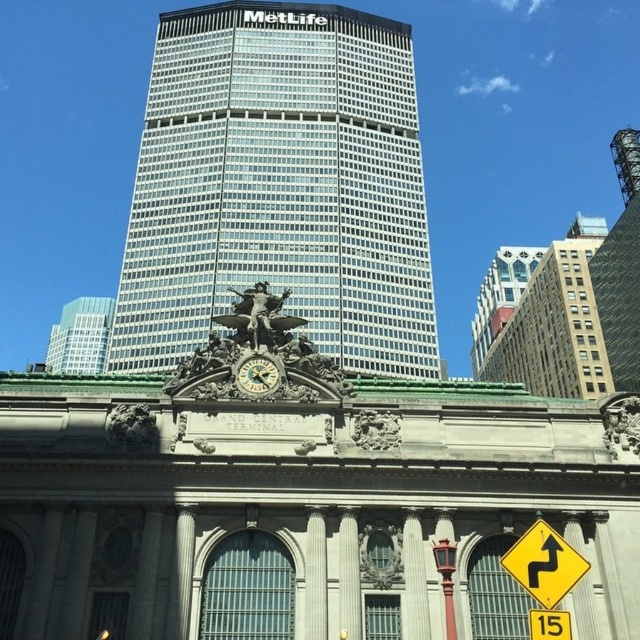
Question: Can you confirm if glassy steel skyscraper at center is positioned below yellow plastic traffic sign at lower right?

Choices:
 (A) no
 (B) yes

Answer: (A)

Question: Can you confirm if glassy steel skyscraper at center is positioned above gold metallic clock at center?

Choices:
 (A) yes
 (B) no

Answer: (A)

Question: Which object is the farthest from the red wood pole at center?

Choices:
 (A) yellow plastic traffic sign at upper right
 (B) brick building at upper right

Answer: (B)

Question: Estimate the real-world distances between objects in this image. Which object is closer to the gold metallic clock at center?

Choices:
 (A) brick building at upper right
 (B) yellow plastic traffic sign at lower right

Answer: (B)

Question: Does yellow plastic traffic sign at lower right appear on the right side of yellow plastic traffic sign at upper right?

Choices:
 (A) no
 (B) yes

Answer: (A)

Question: Which point is closer to the camera taking this photo?

Choices:
 (A) (532, 636)
 (B) (61, 310)

Answer: (A)